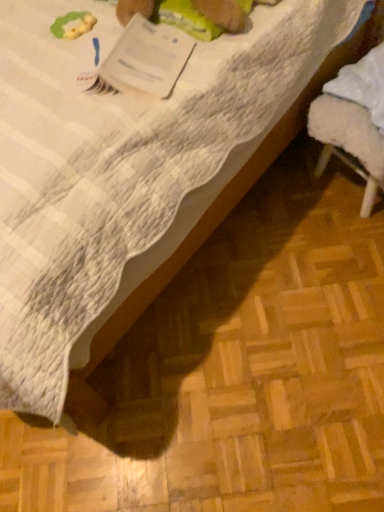
Question: Can you confirm if white paper at upper left is shorter than white fluffy stool at lower right?

Choices:
 (A) no
 (B) yes

Answer: (B)

Question: Is white fluffy stool at lower right inside white paper at upper left?

Choices:
 (A) no
 (B) yes

Answer: (A)

Question: Can you confirm if white paper at upper left is positioned to the right of white fluffy stool at lower right?

Choices:
 (A) no
 (B) yes

Answer: (A)

Question: Is white paper at upper left turned away from white fluffy stool at lower right?

Choices:
 (A) no
 (B) yes

Answer: (A)

Question: From the image's perspective, is white paper at upper left above white fluffy stool at lower right?

Choices:
 (A) no
 (B) yes

Answer: (B)

Question: Is white paper at upper left outside white fluffy stool at lower right?

Choices:
 (A) yes
 (B) no

Answer: (A)

Question: Does white fluffy stool at lower right appear on the left side of white paper at upper left?

Choices:
 (A) yes
 (B) no

Answer: (B)

Question: Is the depth of white fluffy stool at lower right less than that of white paper at upper left?

Choices:
 (A) yes
 (B) no

Answer: (B)

Question: Is white fluffy stool at lower right directly adjacent to white paper at upper left?

Choices:
 (A) no
 (B) yes

Answer: (A)

Question: Does white fluffy stool at lower right have a larger size compared to white paper at upper left?

Choices:
 (A) yes
 (B) no

Answer: (A)

Question: Is white fluffy stool at lower right not inside white paper at upper left?

Choices:
 (A) yes
 (B) no

Answer: (A)

Question: Would you say white fluffy stool at lower right is a long distance from white paper at upper left?

Choices:
 (A) yes
 (B) no

Answer: (B)

Question: Do you think white fluffy stool at lower right is within white paper at upper left, or outside of it?

Choices:
 (A) inside
 (B) outside

Answer: (B)